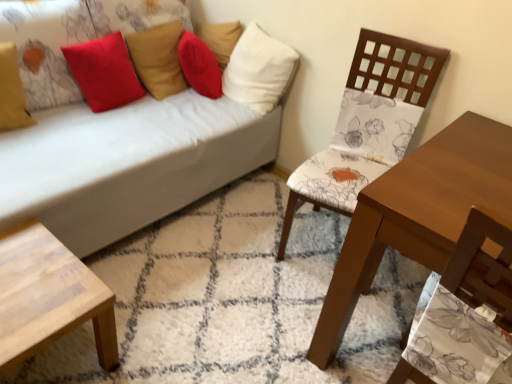
Question: Is red matte pillow at upper left, the 2th pillow when ordered from left to right, wider or thinner than floral fabric chair at center right?

Choices:
 (A) thin
 (B) wide

Answer: (A)

Question: Is red matte pillow at upper left, the 3th pillow positioned from the right, bigger or smaller than floral fabric chair at center right?

Choices:
 (A) big
 (B) small

Answer: (B)

Question: Based on their relative distances, which object is farther from the velvet red pillow at upper left, arranged as the second pillow when viewed from the right?

Choices:
 (A) white fabric couch at upper left
 (B) red matte pillow at upper left, the 3th pillow positioned from the right
 (C) matte yellow pillow at upper left, the fourth pillow viewed from the right
 (D) floral fabric chair at center right
 (E) white fabric pillow at upper center, which ranks as the 1th pillow in right-to-left order

Answer: (D)

Question: Which object is positioned farthest from the matte yellow pillow at upper left, acting as the 1th pillow starting from the left?

Choices:
 (A) red matte pillow at upper left, the 2th pillow when ordered from left to right
 (B) white fabric couch at upper left
 (C) light wood/texture coffee table at lower left
 (D) white fabric pillow at upper center, which ranks as the 1th pillow in right-to-left order
 (E) floral fabric chair at center right

Answer: (E)